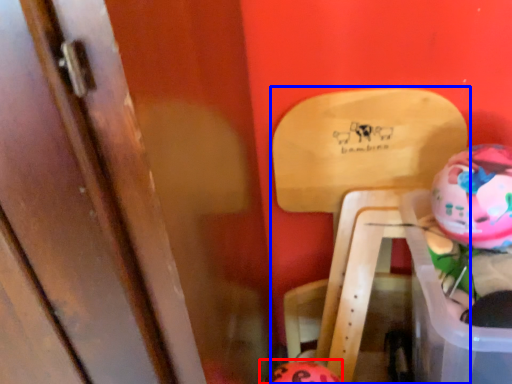
Question: Among these objects, which one is farthest to the camera, piggy bank (highlighted by a red box) or furniture (highlighted by a blue box)?

Choices:
 (A) piggy bank
 (B) furniture

Answer: (A)